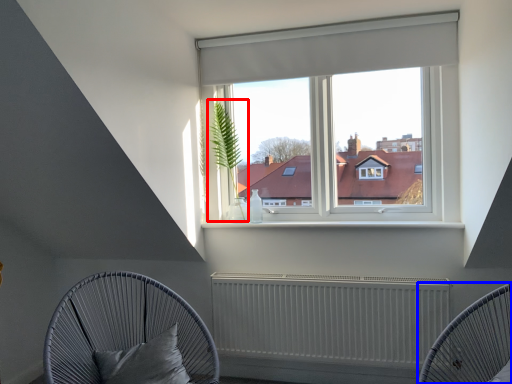
Question: Which point is closer to the camera, plant (highlighted by a red box) or furniture (highlighted by a blue box)?

Choices:
 (A) plant
 (B) furniture

Answer: (B)